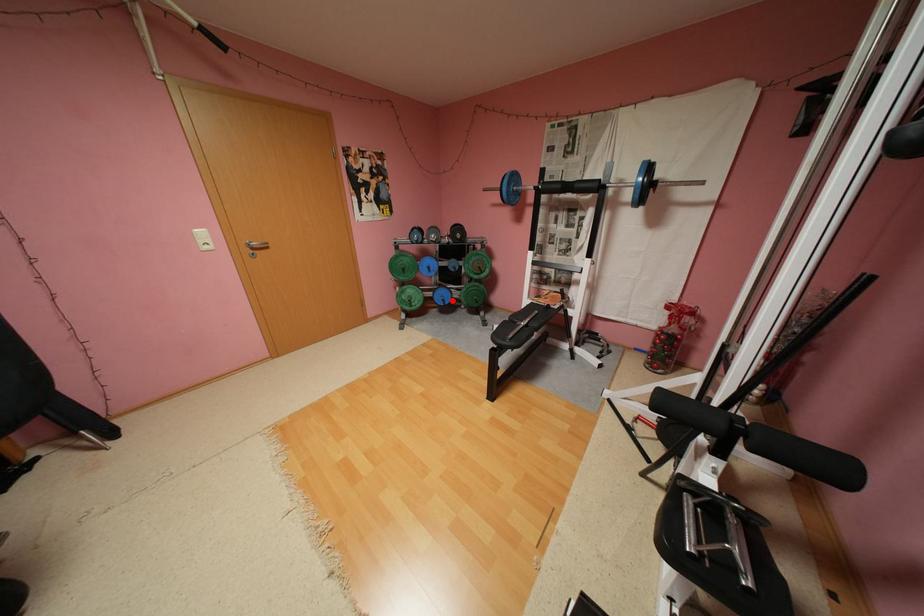
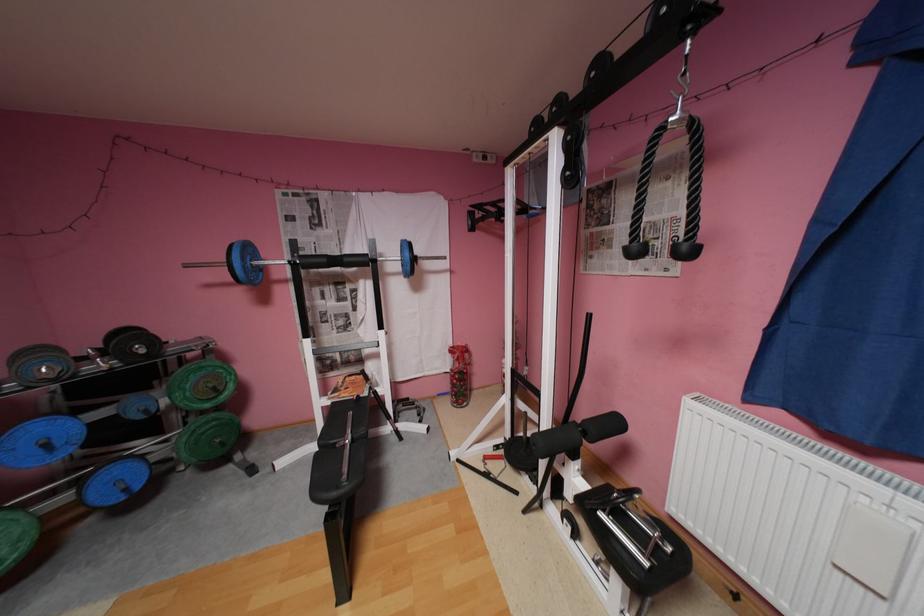
Locate, in the second image, the point that corresponds to the highlighted location in the first image.

(134, 488)